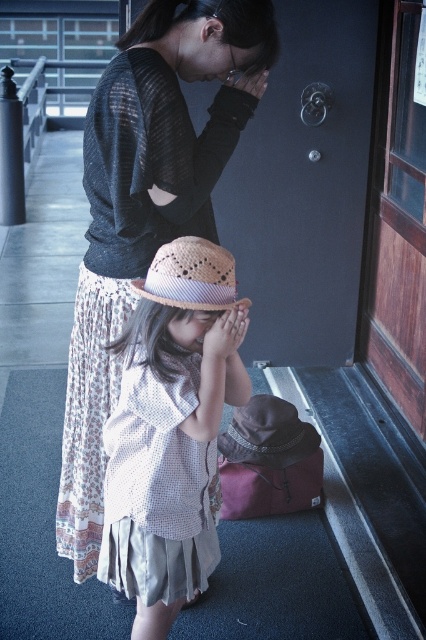
What are the coordinates of `matte black sweater at upper center` in the screenshot? It's located at (146, 205).

Is matte black sweater at upper center thinner than natural straw hat at lower center?

No, matte black sweater at upper center is not thinner than natural straw hat at lower center.

Locate an element on the screen. matte black sweater at upper center is located at coordinates click(146, 205).

Does natural straw hat at center appear over natural straw hat at lower center?

Yes.

Find the location of a particular element. The image size is (426, 640). natural straw hat at center is located at coordinates (192, 276).

Locate an element on the screen. The image size is (426, 640). natural straw hat at center is located at coordinates (192, 276).

Can you confirm if matte black sweater at upper center is positioned above natural straw hat at center?

No, matte black sweater at upper center is not above natural straw hat at center.

Is point (158, 144) closer to viewer compared to point (216, 260)?

No, it is not.

The image size is (426, 640). I want to click on matte black sweater at upper center, so click(x=146, y=205).